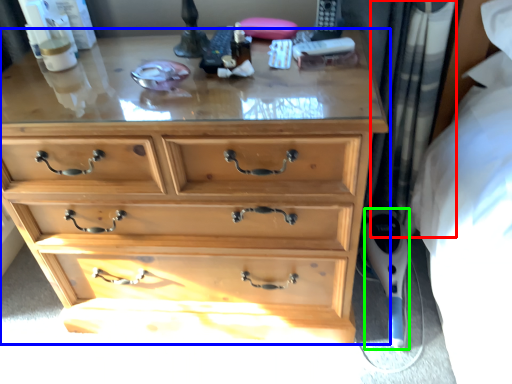
Question: Based on their relative distances, which object is nearer to curtain (highlighted by a red box)? Choose from chest of drawers (highlighted by a blue box) and equipment (highlighted by a green box).

Choices:
 (A) chest of drawers
 (B) equipment

Answer: (B)